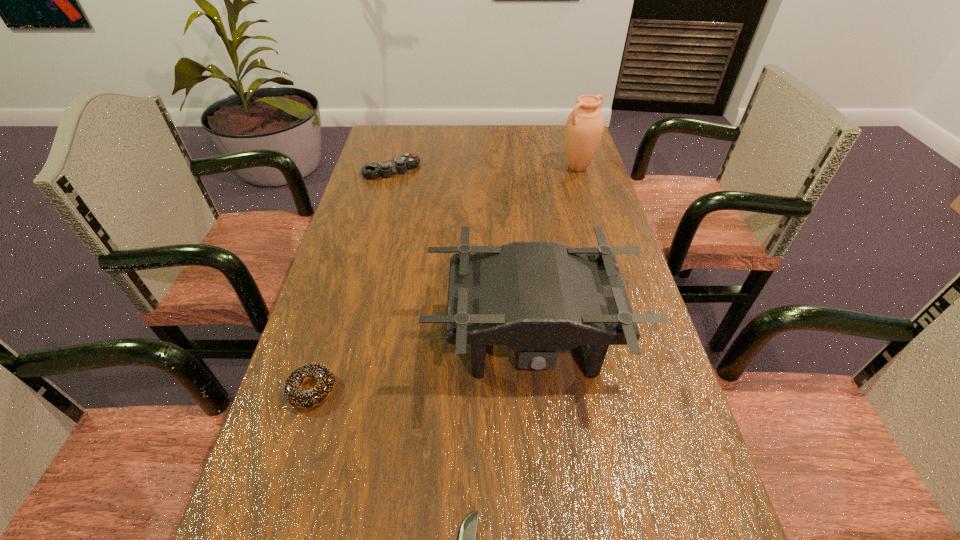
The image size is (960, 540). Find the location of `free space between the drone and the fourth tallest object`. free space between the drone and the fourth tallest object is located at coordinates (421, 365).

Point out which object is positioned as the nearest to the urn. Please provide its 2D coordinates. Your answer should be formatted as a tuple, i.e. [(x, y)], where the tuple contains the x and y coordinates of a point satisfying the conditions above.

[(399, 165)]

Locate which object is the third closest to the pocketknife. Please provide its 2D coordinates. Your answer should be formatted as a tuple, i.e. [(x, y)], where the tuple contains the x and y coordinates of a point satisfying the conditions above.

[(399, 165)]

Image resolution: width=960 pixels, height=540 pixels. I want to click on vacant region that satisfies the following two spatial constraints: 1. on the back side of the urn; 2. on the right side of the third shortest object, so click(x=393, y=167).

The height and width of the screenshot is (540, 960). What are the coordinates of `free space in the image that satisfies the following two spatial constraints: 1. on the back side of the control; 2. on the right side of the doughnut` in the screenshot? It's located at pyautogui.click(x=378, y=170).